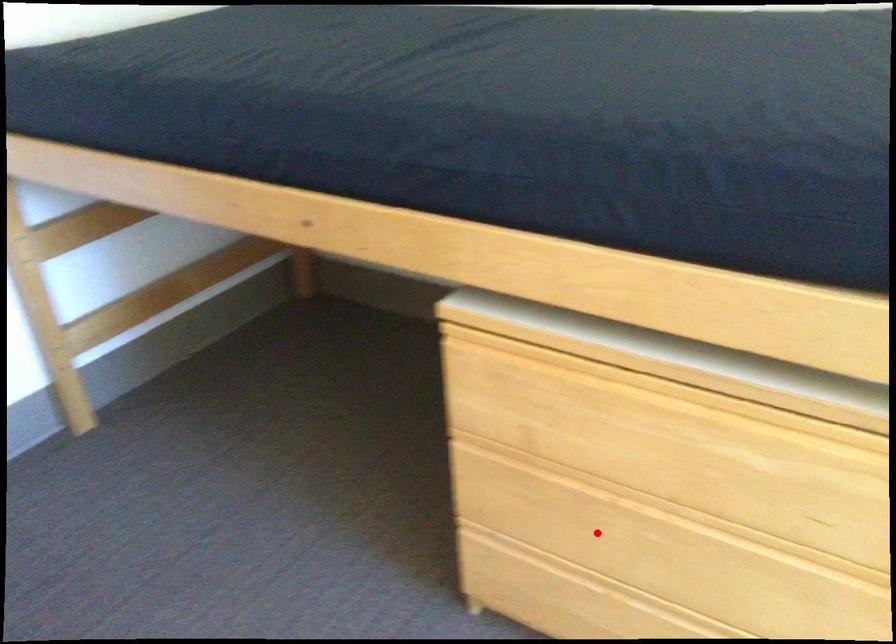
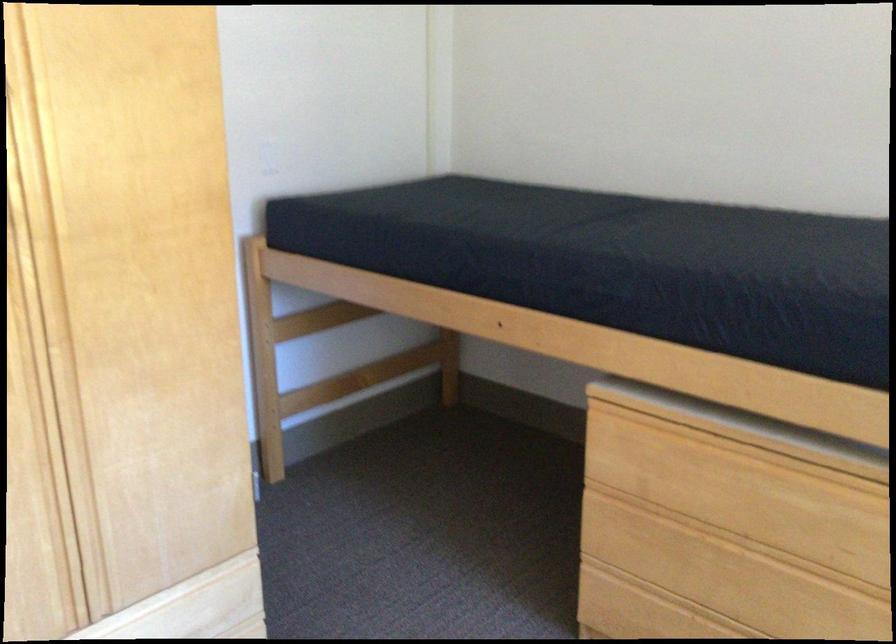
Question: I am providing you with two images of the same scene from different viewpoints. A red point is shown in image1. For the corresponding object point in image2, is it positioned nearer or farther from the camera?

Choices:
 (A) Nearer
 (B) Farther

Answer: (B)